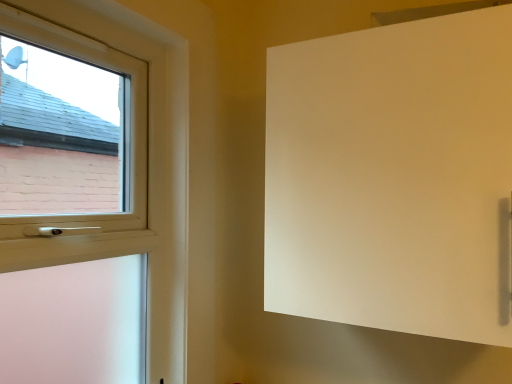
Measure the distance between point (310, 235) and camera.

They are 3.44 feet apart.

What do you see at coordinates (393, 177) in the screenshot?
I see `white matte screen door at upper right` at bounding box center [393, 177].

Where is `white matte screen door at upper right`? white matte screen door at upper right is located at coordinates (393, 177).

Measure the distance between white plastic window at left and camera.

The distance of white plastic window at left from camera is 36.84 inches.

What do you see at coordinates (152, 160) in the screenshot? I see `white plastic window at left` at bounding box center [152, 160].

This screenshot has width=512, height=384. Identify the location of white plastic window at left. [x=152, y=160].

Measure the distance between point (114, 32) and camera.

Point (114, 32) is 3.89 feet from camera.

Find the location of a particular element. white matte screen door at upper right is located at coordinates (393, 177).

Which is more to the left, white matte screen door at upper right or white plastic window at left?

Positioned to the left is white plastic window at left.

Considering the positions of objects white matte screen door at upper right and white plastic window at left in the image provided, who is in front, white matte screen door at upper right or white plastic window at left?

Positioned in front is white plastic window at left.

Is point (415, 310) positioned in front of point (174, 347)?

Yes, it is in front of point (174, 347).

From the image's perspective, is white matte screen door at upper right above or below white plastic window at left?

white matte screen door at upper right is situated higher than white plastic window at left in the image.

From a real-world perspective, which object rests below the other?

In real-world perspective, white plastic window at left is lower.

Can you confirm if white matte screen door at upper right is wider than white plastic window at left?

Yes, white matte screen door at upper right is wider than white plastic window at left.

In the scene shown: Which of these two, white matte screen door at upper right or white plastic window at left, stands shorter?

Standing shorter between the two is white matte screen door at upper right.

In terms of size, does white matte screen door at upper right appear bigger or smaller than white plastic window at left?

Clearly, white matte screen door at upper right is larger in size than white plastic window at left.

Is white matte screen door at upper right spatially inside white plastic window at left, or outside of it?

white matte screen door at upper right lies outside white plastic window at left.

Are white matte screen door at upper right and white plastic window at left beside each other?

No, white matte screen door at upper right is not with white plastic window at left.

Looking at this image, does white matte screen door at upper right turn towards white plastic window at left?

No, white matte screen door at upper right is not turned towards white plastic window at left.

The image size is (512, 384). Identify the location of window below the white matte screen door at upper right (from the image's perspective). (152, 160).

Is white plastic window at left at the left side of white matte screen door at upper right?

Yes, white plastic window at left is to the left of white matte screen door at upper right.

Is white plastic window at left positioned in front of white matte screen door at upper right?

Yes, white plastic window at left is in front of white matte screen door at upper right.

Is point (167, 287) behind point (459, 175)?

Yes.

From the image's perspective, is white plastic window at left positioned above or below white matte screen door at upper right?

white plastic window at left is below white matte screen door at upper right.

From a real-world perspective, does white plastic window at left stand above white matte screen door at upper right?

No.

Which of these two, white plastic window at left or white matte screen door at upper right, is thinner?

white plastic window at left is thinner.

From their relative heights in the image, would you say white plastic window at left is taller or shorter than white matte screen door at upper right?

Considering their sizes, white plastic window at left has more height than white matte screen door at upper right.

Who is smaller, white plastic window at left or white matte screen door at upper right?

white plastic window at left is smaller.

Is white plastic window at left positioned beyond the bounds of white matte screen door at upper right?

Yes, white plastic window at left is outside of white matte screen door at upper right.

Is there a large distance between white plastic window at left and white matte screen door at upper right?

white plastic window at left is near white matte screen door at upper right, not far away.

Is white plastic window at left turned away from white matte screen door at upper right?

No, white plastic window at left's orientation is not away from white matte screen door at upper right.

Identify the location of screen door above the white plastic window at left (from a real-world perspective). This screenshot has width=512, height=384. (393, 177).

The width and height of the screenshot is (512, 384). Find the location of `screen door lying on the right of white plastic window at left`. screen door lying on the right of white plastic window at left is located at coordinates (393, 177).

Identify the location of window below the white matte screen door at upper right (from a real-world perspective). Image resolution: width=512 pixels, height=384 pixels. (152, 160).